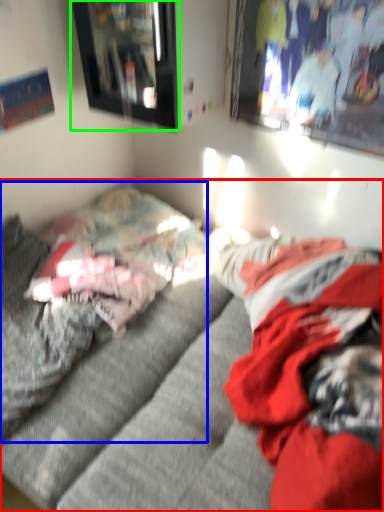
Question: Which object is positioned farthest from studio couch (highlighted by a red box)? Select from bed (highlighted by a blue box) and picture frame (highlighted by a green box).

Choices:
 (A) bed
 (B) picture frame

Answer: (B)